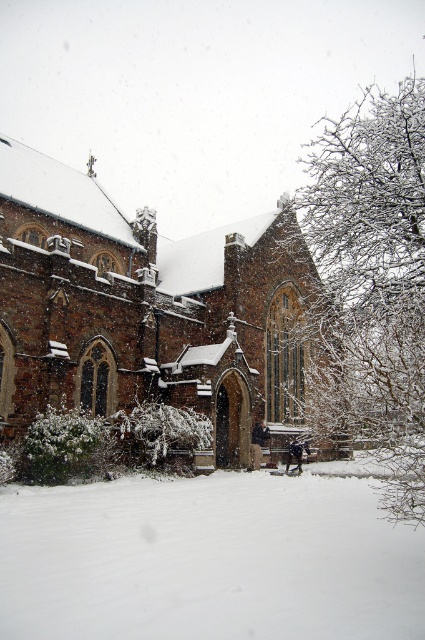
You are standing in the winter scene and want to take a photo of the brown stone church at center. Where should you position yourself relative to the white fluffy snow at lower center to ensure the church is fully in the frame?

You should position yourself above the white fluffy snow at lower center because the brown stone church at center is located above it, so positioning yourself higher will allow the church to be fully visible in the frame.

You are standing in the winter scene and want to walk towards the brown stone church at center. Which direction should you move relative to the white fluffy snow at lower center?

Since the brown stone church at center is further to the viewer than the white fluffy snow at lower center, you should move towards the direction of the brown stone church at center, which is closer to you than the snow. Wait, but the snow is at lower center. Hmm, maybe I need to think differently. The question is about direction relative to the snow. If the church is closer to the viewer, then the snow is behind it? Or maybe the snow is in front? Wait the objects description says the church is further to